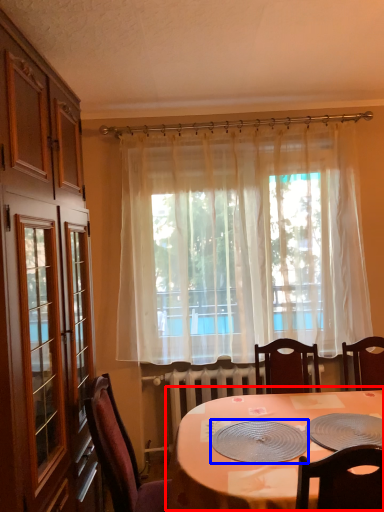
Question: Among these objects, which one is nearest to the camera, table (highlighted by a red box) or platter (highlighted by a blue box)?

Choices:
 (A) table
 (B) platter

Answer: (A)